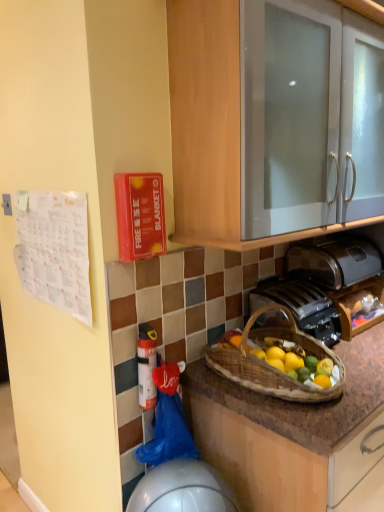
The image size is (384, 512). Find the location of `white glossy cabinet at upper center`. white glossy cabinet at upper center is located at coordinates (211, 128).

The width and height of the screenshot is (384, 512). What do you see at coordinates (273, 367) in the screenshot?
I see `brown woven picnic basket at lower center` at bounding box center [273, 367].

What do you see at coordinates (334, 261) in the screenshot? I see `satin silver toaster at lower right` at bounding box center [334, 261].

The height and width of the screenshot is (512, 384). What do you see at coordinates (300, 306) in the screenshot? I see `metallic silver toaster at lower center` at bounding box center [300, 306].

Where is `white glossy cabinet at upper center`? Image resolution: width=384 pixels, height=512 pixels. white glossy cabinet at upper center is located at coordinates (211, 128).

Does point (300, 275) come behind point (340, 330)?

Yes, point (300, 275) is behind point (340, 330).

Considering the sizes of satin silver toaster at lower right and metallic silver toaster at lower center in the image, is satin silver toaster at lower right wider or thinner than metallic silver toaster at lower center?

satin silver toaster at lower right is thinner than metallic silver toaster at lower center.

Can you confirm if satin silver toaster at lower right is positioned to the right of metallic silver toaster at lower center?

Yes, satin silver toaster at lower right is to the right of metallic silver toaster at lower center.

How much distance is there between satin silver toaster at lower right and metallic silver toaster at lower center?

satin silver toaster at lower right is 21.76 centimeters away from metallic silver toaster at lower center.

Where is `gas stove located on the left of satin silver toaster at lower right`? This screenshot has height=512, width=384. gas stove located on the left of satin silver toaster at lower right is located at coordinates (300, 306).

Is metallic silver toaster at lower center oriented away from satin silver toaster at lower right?

No, metallic silver toaster at lower center is not facing the opposite direction of satin silver toaster at lower right.

From the image's perspective, between metallic silver toaster at lower center and satin silver toaster at lower right, which one is located above?

satin silver toaster at lower right is shown above in the image.

Considering the sizes of objects metallic silver toaster at lower center and satin silver toaster at lower right in the image provided, who is wider, metallic silver toaster at lower center or satin silver toaster at lower right?

metallic silver toaster at lower center is wider.

Is white plastic extinguisher at lower center positioned with its back to metallic silver toaster at lower center?

No, white plastic extinguisher at lower center is not facing away from metallic silver toaster at lower center.

Can you confirm if white plastic extinguisher at lower center is bigger than metallic silver toaster at lower center?

Actually, white plastic extinguisher at lower center might be smaller than metallic silver toaster at lower center.

Does point (150, 335) lie behind point (309, 308)?

That is False.

From the image's perspective, which one is positioned lower, white plastic extinguisher at lower center or metallic silver toaster at lower center?

white plastic extinguisher at lower center.

Considering the sizes of objects satin silver toaster at lower right and white glossy cabinet at upper center in the image provided, who is thinner, satin silver toaster at lower right or white glossy cabinet at upper center?

satin silver toaster at lower right.

Could you tell me if satin silver toaster at lower right is facing white glossy cabinet at upper center?

No, satin silver toaster at lower right is not oriented towards white glossy cabinet at upper center.

From the image's perspective, which is below, satin silver toaster at lower right or white glossy cabinet at upper center?

satin silver toaster at lower right.

Between satin silver toaster at lower right and white glossy cabinet at upper center, which one has smaller size?

Smaller between the two is satin silver toaster at lower right.

Consider the image. Measure the distance between satin silver toaster at lower right and white plastic extinguisher at lower center.

satin silver toaster at lower right is 34.96 inches away from white plastic extinguisher at lower center.

Between satin silver toaster at lower right and white plastic extinguisher at lower center, which one appears on the right side from the viewer's perspective?

Positioned to the right is satin silver toaster at lower right.

From the image's perspective, would you say satin silver toaster at lower right is shown under white plastic extinguisher at lower center?

No, from the image's perspective, satin silver toaster at lower right is not beneath white plastic extinguisher at lower center.

Is satin silver toaster at lower right completely or partially outside of white plastic extinguisher at lower center?

Yes, satin silver toaster at lower right is not within white plastic extinguisher at lower center.

Locate an element on the screen. cabinetry above the brown woven picnic basket at lower center (from a real-world perspective) is located at coordinates (211, 128).

Is white glossy cabinet at upper center surrounded by brown woven picnic basket at lower center?

No, white glossy cabinet at upper center is located outside of brown woven picnic basket at lower center.

From the image's perspective, which one is positioned lower, brown woven picnic basket at lower center or white glossy cabinet at upper center?

From the image's view, brown woven picnic basket at lower center is below.

Which is in front, brown woven picnic basket at lower center or white glossy cabinet at upper center?

Positioned in front is white glossy cabinet at upper center.

Could you measure the distance between white glossy cabinet at upper center and metallic silver toaster at lower center?

20.71 inches.

Find the location of a particular element. Image resolution: width=384 pixels, height=512 pixels. gas stove located on the left of white glossy cabinet at upper center is located at coordinates (300, 306).

Which of these two, white glossy cabinet at upper center or metallic silver toaster at lower center, is smaller?

metallic silver toaster at lower center is smaller.

Which is less distant, (184, 32) or (250, 314)?

The point (184, 32) is closer to the camera.

Locate an element on the screen. toaster on the right of metallic silver toaster at lower center is located at coordinates (334, 261).

At what (x,y) coordinates should I click in order to perform the action: click on toaster above the metallic silver toaster at lower center (from the image's perspective). Please return your answer as a coordinate pair (x, y). This screenshot has height=512, width=384. Looking at the image, I should click on [334, 261].

When comparing their distances from satin silver toaster at lower right, does white glossy cabinet at upper center or white plastic extinguisher at lower center seem closer?

white glossy cabinet at upper center is positioned closer to the anchor satin silver toaster at lower right.

Looking at the image, which one is located further to metallic silver toaster at lower center, white plastic extinguisher at lower center or brown woven picnic basket at lower center?

white plastic extinguisher at lower center lies further to metallic silver toaster at lower center than the other object.

When comparing their distances from metallic silver toaster at lower center, does white plastic extinguisher at lower center or satin silver toaster at lower right seem further?

Among the two, white plastic extinguisher at lower center is located further to metallic silver toaster at lower center.

From the image, which object appears to be nearer to white plastic extinguisher at lower center, satin silver toaster at lower right or white glossy cabinet at upper center?

Among the two, white glossy cabinet at upper center is located nearer to white plastic extinguisher at lower center.

From the image, which object appears to be farther from brown woven picnic basket at lower center, satin silver toaster at lower right or white plastic extinguisher at lower center?

satin silver toaster at lower right.

Based on their spatial positions, is white glossy cabinet at upper center or metallic silver toaster at lower center closer to white plastic extinguisher at lower center?

metallic silver toaster at lower center lies closer to white plastic extinguisher at lower center than the other object.

Based on their spatial positions, is brown woven picnic basket at lower center or white plastic extinguisher at lower center closer to satin silver toaster at lower right?

Based on the image, brown woven picnic basket at lower center appears to be nearer to satin silver toaster at lower right.

Which object lies nearer to the anchor point white plastic extinguisher at lower center, white glossy cabinet at upper center or brown woven picnic basket at lower center?

brown woven picnic basket at lower center lies closer to white plastic extinguisher at lower center than the other object.

Find the location of a particular element. Image resolution: width=384 pixels, height=512 pixels. gas stove between brown woven picnic basket at lower center and satin silver toaster at lower right in the front-back direction is located at coordinates (300, 306).

Locate an element on the screen. gas stove between white plastic extinguisher at lower center and satin silver toaster at lower right from left to right is located at coordinates (300, 306).

Locate an element on the screen. The image size is (384, 512). gas stove between white glossy cabinet at upper center and white plastic extinguisher at lower center from top to bottom is located at coordinates (300, 306).

Locate an element on the screen. The height and width of the screenshot is (512, 384). toaster between white glossy cabinet at upper center and metallic silver toaster at lower center from top to bottom is located at coordinates (334, 261).